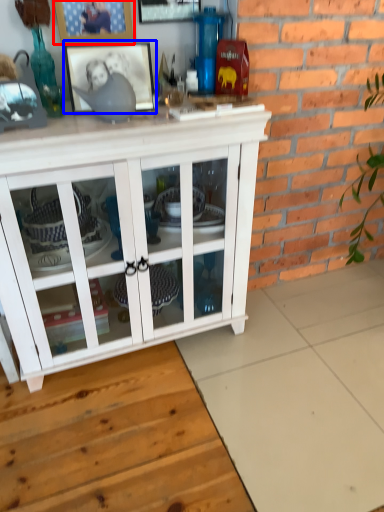
Question: Which object is further to the camera taking this photo, picture frame (highlighted by a red box) or picture frame (highlighted by a blue box)?

Choices:
 (A) picture frame
 (B) picture frame

Answer: (A)